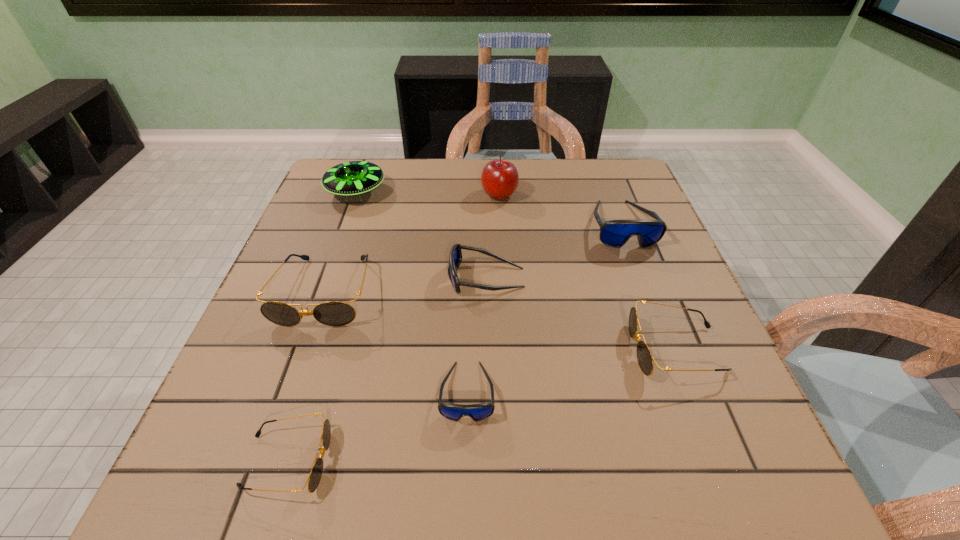
Locate an element on the screen. The width and height of the screenshot is (960, 540). vacant point located on the lenses of the rightmost black sunglasses is located at coordinates (595, 349).

You are a GUI agent. You are given a task and a screenshot of the screen. Output one action in this format:
    pyautogui.click(x=<x>, y=<y>)
    Task: Click on the free space located 0.110m on the front-facing side of the smallest blue sunglasses
    
    Given the screenshot: What is the action you would take?
    pyautogui.click(x=465, y=495)

The image size is (960, 540). Identify the location of free space located on the lenses of the shortest sunglasses. (423, 461).

Where is `apple located in the far edge section of the desktop`? This screenshot has width=960, height=540. apple located in the far edge section of the desktop is located at coordinates (499, 178).

You are a GUI agent. You are given a task and a screenshot of the screen. Output one action in this format:
    pyautogui.click(x=<x>, y=<y>)
    Task: Click on the saucer present at the far edge
    The height and width of the screenshot is (540, 960).
    Given the screenshot: What is the action you would take?
    pyautogui.click(x=352, y=178)

Where is `sunglasses present at the far edge`? Image resolution: width=960 pixels, height=540 pixels. sunglasses present at the far edge is located at coordinates (615, 233).

Locate an element on the screen. This screenshot has height=540, width=960. object at the near edge is located at coordinates (314, 478).

You are a GUI agent. You are given a task and a screenshot of the screen. Output one action in this format:
    pyautogui.click(x=<x>, y=<y>)
    Task: Click on the saucer situated at the left edge
    Image resolution: width=960 pixels, height=540 pixels.
    Given the screenshot: What is the action you would take?
    pyautogui.click(x=352, y=178)

Identify the location of object positioned at the far left corner. (352, 178).

What are the coordinates of `object present at the near left corner` in the screenshot? It's located at (314, 478).